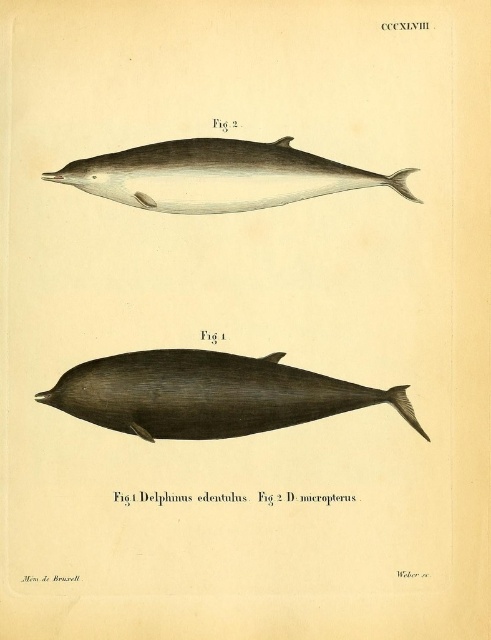
Question: Is dark gray smooth dolphin at bottom bigger than smooth gray dolphin at upper center?

Choices:
 (A) no
 (B) yes

Answer: (B)

Question: Observing the image, what is the correct spatial positioning of dark gray smooth dolphin at bottom in reference to smooth gray dolphin at upper center?

Choices:
 (A) below
 (B) above

Answer: (A)

Question: Observing the image, what is the correct spatial positioning of dark gray smooth dolphin at bottom in reference to smooth gray dolphin at upper center?

Choices:
 (A) right
 (B) left

Answer: (A)

Question: Among these objects, which one is nearest to the camera?

Choices:
 (A) smooth gray dolphin at upper center
 (B) dark gray smooth dolphin at bottom

Answer: (B)

Question: Among these points, which one is farthest from the camera?

Choices:
 (A) (180, 211)
 (B) (100, 412)

Answer: (A)

Question: Among these points, which one is nearest to the camera?

Choices:
 (A) (207, 362)
 (B) (288, 182)

Answer: (B)